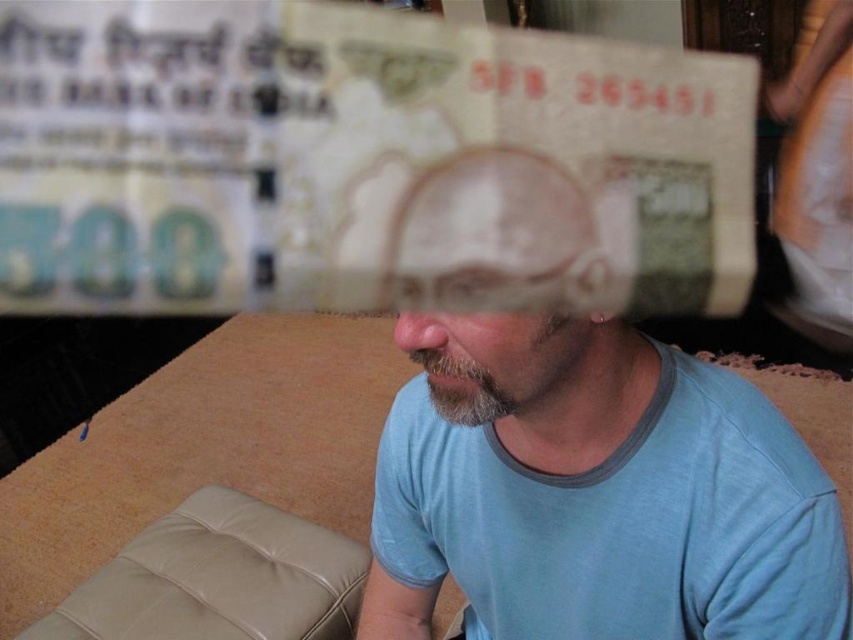
You are trying to determine the visibility of two points in the image. The first point is at coordinates point (62,29) and the second is at point (654,378). Based on the scene description, which point is closer to the viewer?

Point (62,29) is in front of point (654,378), so it is closer to the viewer.

You are a currency inspector holding a magnifying glass. You need to examine the light brown paper currency at upper center. Can you reach it with your magnifying glass if you are standing 33.95 centimeters away from it?

Yes, since the light brown paper currency at upper center is exactly 33.95 centimeters away from the viewer, the magnifying glass can reach it easily.

You are a bank employee checking a stack of Indian rupee notes. You notice two types of currency in the image. The first is the light brown paper currency at upper center and the second is the matte paper currency at center. Based on their positions, which currency is closer to the left side of the image?

The light brown paper currency at upper center is to the left of the matte paper currency at center, so the light brown paper currency at upper center is closer to the left side of the image.